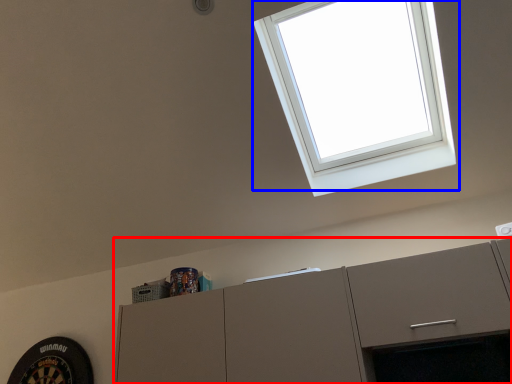
Question: Which object appears farthest to the camera in this image, cabinetry (highlighted by a red box) or window (highlighted by a blue box)?

Choices:
 (A) cabinetry
 (B) window

Answer: (A)